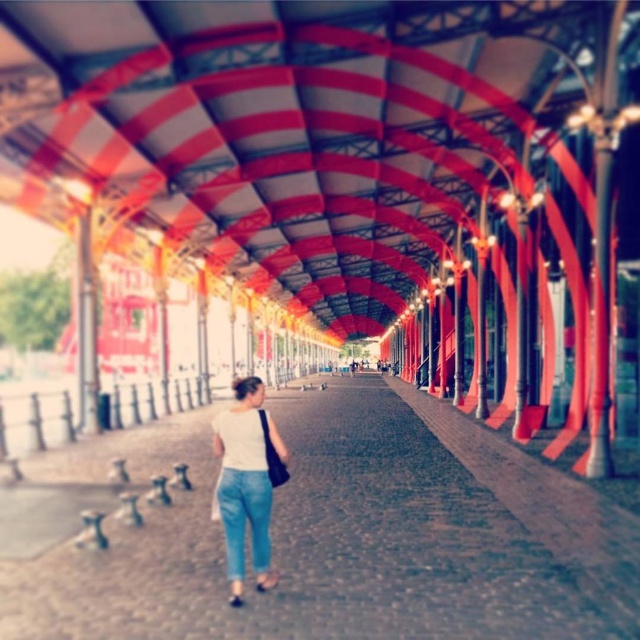
Can you confirm if brown cobblestone pavement at center is bigger than blue denim jeans at center?

Indeed, brown cobblestone pavement at center has a larger size compared to blue denim jeans at center.

Who is positioned more to the right, brown cobblestone pavement at center or blue denim jeans at center?

brown cobblestone pavement at center

You are a GUI agent. You are given a task and a screenshot of the screen. Output one action in this format:
    pyautogui.click(x=<x>, y=<y>)
    Task: Click on the brown cobblestone pavement at center
    This screenshot has height=640, width=640.
    Given the screenshot: What is the action you would take?
    pyautogui.click(x=324, y=532)

Find the location of `brown cobblestone pavement at center`. brown cobblestone pavement at center is located at coordinates (324, 532).

Is point (406, 584) behind point (262, 508)?

That is True.

Which of these two, brown cobblestone pavement at center or white matte shirt at center, stands shorter?

With less height is brown cobblestone pavement at center.

Between point (403, 502) and point (284, 449), which one is positioned in front?

Point (284, 449) is in front.

This screenshot has height=640, width=640. What are the coordinates of `brown cobblestone pavement at center` in the screenshot? It's located at 324,532.

What do you see at coordinates (244, 481) in the screenshot? I see `white matte shirt at center` at bounding box center [244, 481].

What are the coordinates of `white matte shirt at center` in the screenshot? It's located at (244, 481).

Identify the location of white matte shirt at center. The height and width of the screenshot is (640, 640). (244, 481).